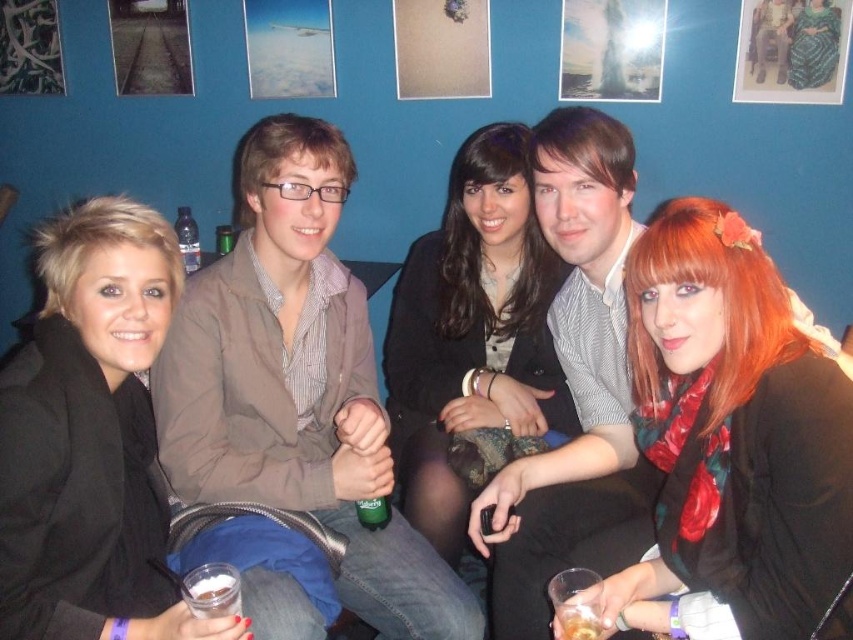
Question: Which point appears farthest from the camera in this image?

Choices:
 (A) (376, 508)
 (B) (485, 323)
 (C) (119, 609)

Answer: (B)

Question: Which point is closer to the camera taking this photo?

Choices:
 (A) (543, 241)
 (B) (234, 608)
 (C) (648, 408)
 (D) (554, 612)

Answer: (B)

Question: Which point appears farthest from the camera in this image?

Choices:
 (A) (374, 525)
 (B) (73, 579)
 (C) (744, 627)

Answer: (A)

Question: Can you confirm if brown cotton jacket at center is wider than translucent plastic cup at lower center?

Choices:
 (A) no
 (B) yes

Answer: (B)

Question: Can you confirm if floral scarf at center is bigger than green matte can at center?

Choices:
 (A) no
 (B) yes

Answer: (B)

Question: Is floral scarf at center wider than black matte jacket at left?

Choices:
 (A) yes
 (B) no

Answer: (B)